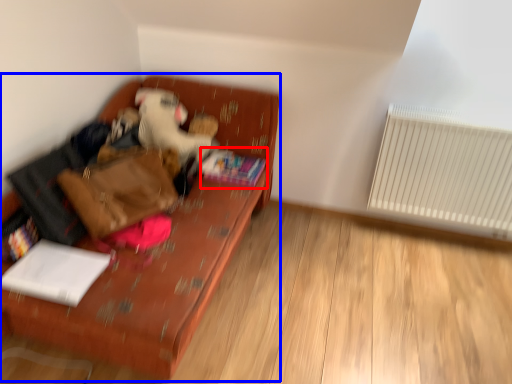
Question: Which of the following is the farthest to the observer, book (highlighted by a red box) or furniture (highlighted by a blue box)?

Choices:
 (A) book
 (B) furniture

Answer: (A)